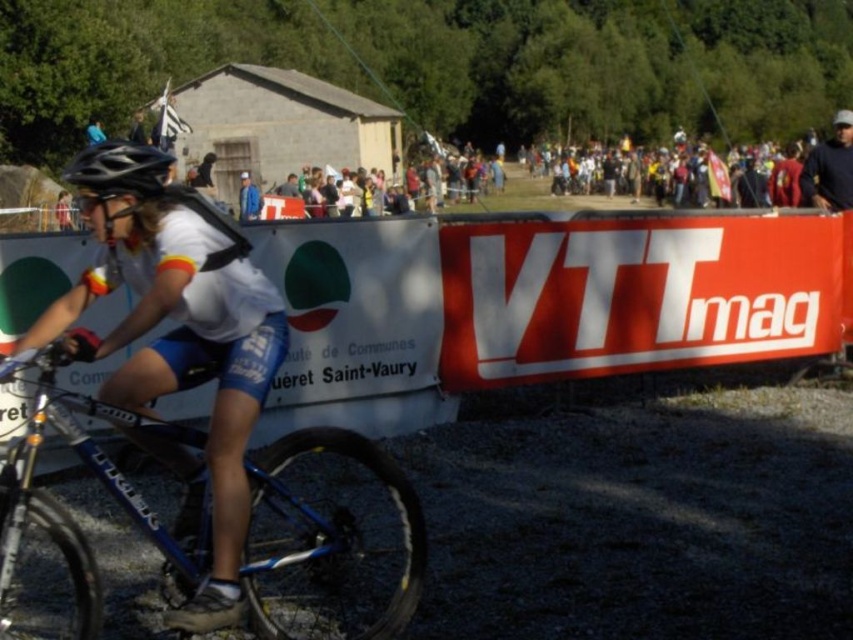
You are a photographer at the mountain bike race and need to capture a shot of both the black matte helmet at center and the dark blue shirt at upper right in the same frame. Based on their positions, which object should you adjust your camera to focus on first to ensure both are in the frame?

The black matte helmet at center is to the left of the dark blue shirt at upper right, so you should focus on the dark blue shirt at upper right first to ensure both are captured in the frame.

You are a photographer trying to capture the cyclist and their gear. You notice the blue metallic bicycle at center and the black matte helmet at center. Which object is positioned closer to your camera lens?

The blue metallic bicycle at center is closer to the viewer than the black matte helmet at center, so the blue metallic bicycle at center would appear closer to the camera lens.